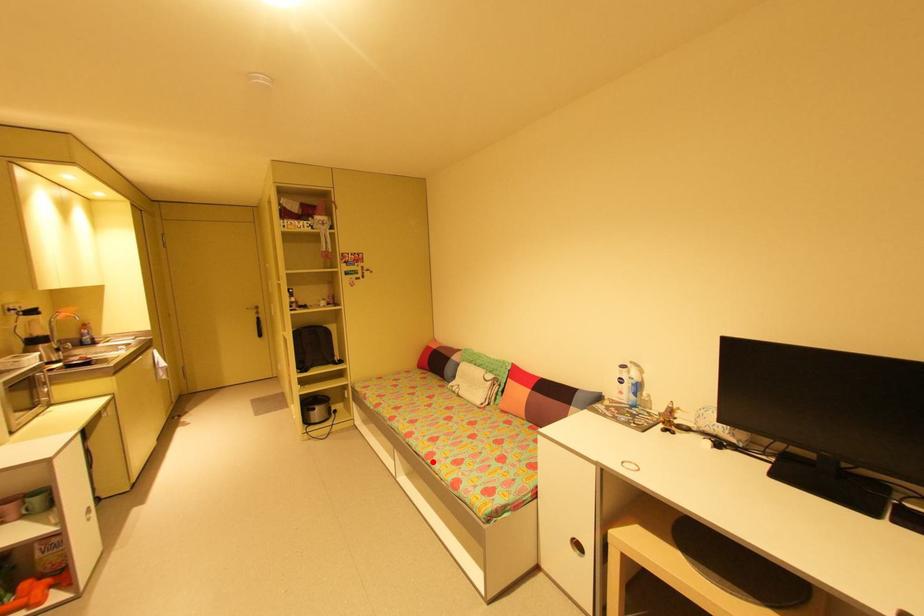
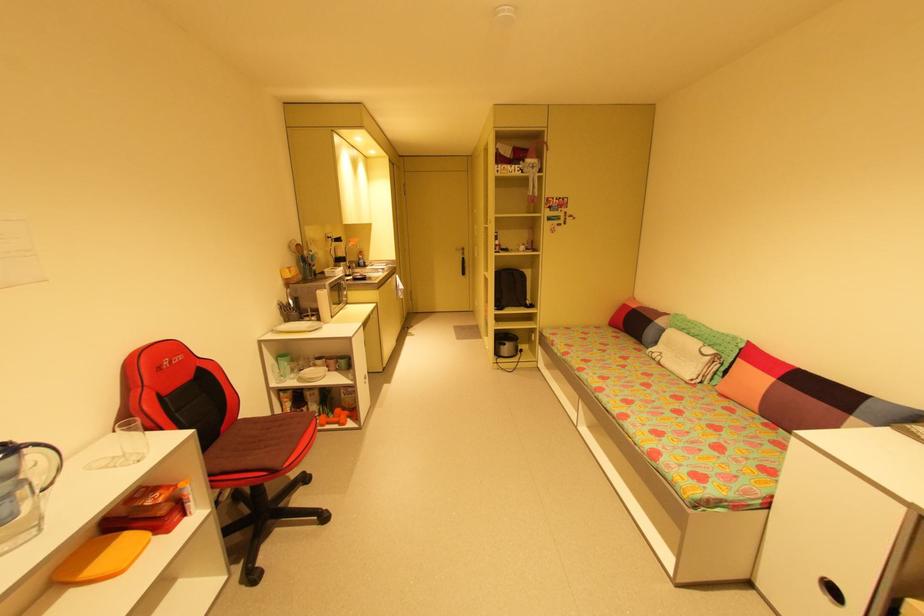
Question: I am providing you with two images of the same scene from different viewpoints. In image1, a red point is highlighted. Considering the same 3D point in image2, which of the following is correct?

Choices:
 (A) It is closer
 (B) It is farther

Answer: (A)